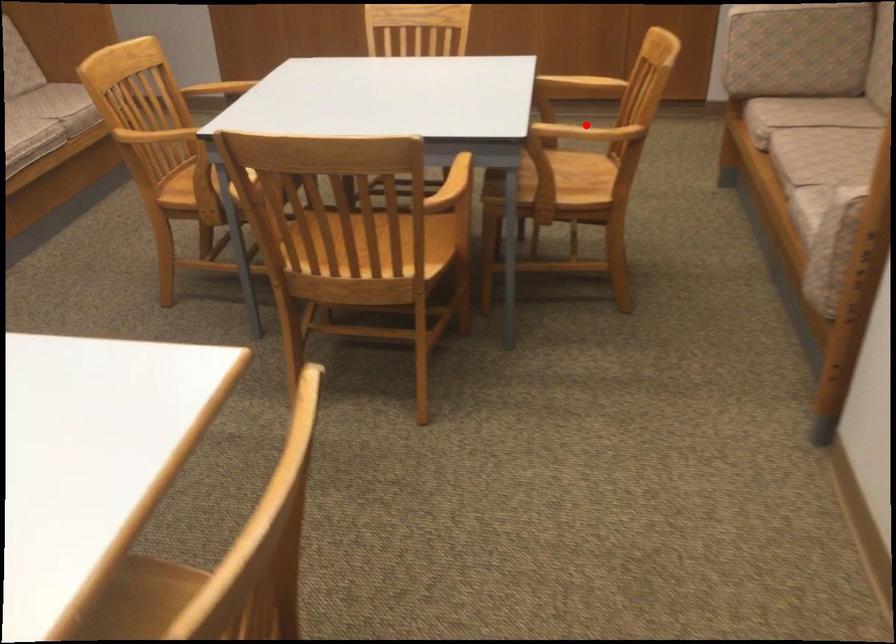
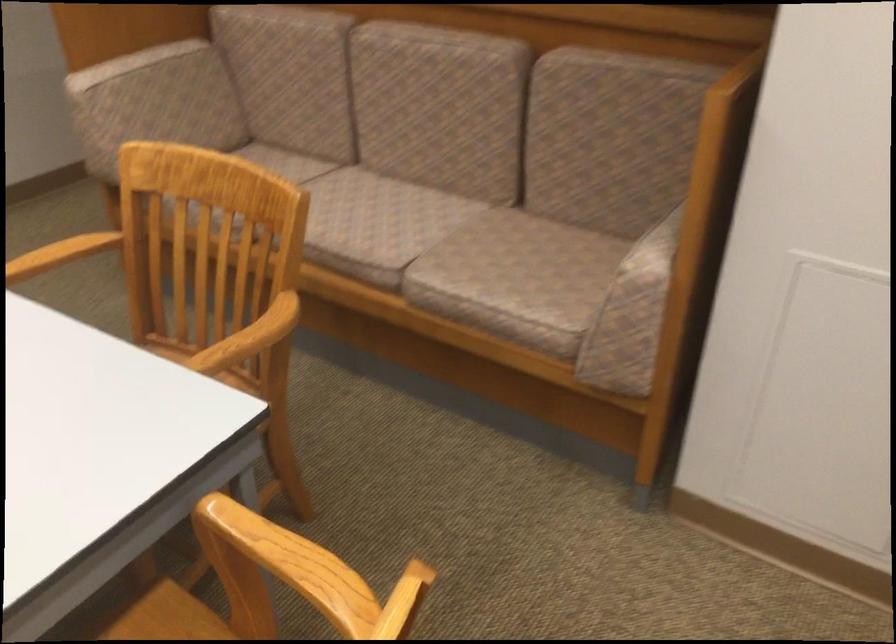
Question: I am providing you with two images of the same scene from different viewpoints. In image1, a red point is highlighted. Considering the same 3D point in image2, which of the following is correct?

Choices:
 (A) It is closer
 (B) It is farther

Answer: (A)